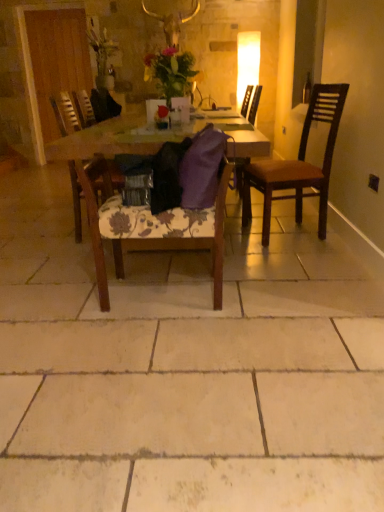
The height and width of the screenshot is (512, 384). Find the location of `unoccupied space behind wooden chair at center, placed as the 2th chair when sorted from right to left`. unoccupied space behind wooden chair at center, placed as the 2th chair when sorted from right to left is located at coordinates (168, 263).